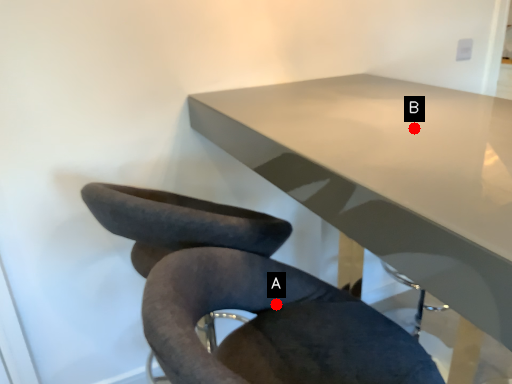
Question: Two points are circled on the image, labeled by A and B beside each circle. Which of the following is the farthest from the observer?

Choices:
 (A) A is further
 (B) B is further

Answer: (B)